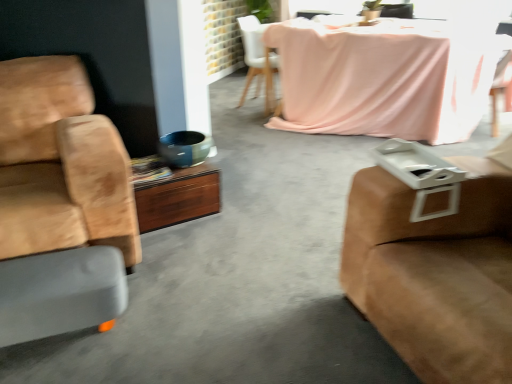
Identify the location of pink fabric chair at upper center, which is the second chair in right-to-left order. tap(258, 61).

The width and height of the screenshot is (512, 384). In order to click on wooden chair at upper right, the 1th chair when ordered from right to left in this screenshot , I will do `click(499, 88)`.

The height and width of the screenshot is (384, 512). What are the coordinates of `pink fabric-covered table at upper center` in the screenshot? It's located at (383, 79).

Identify the location of gray rubber footrest at lower left. (60, 293).

Is gray rubber footrest at lower left directly adjacent to pink fabric-covered table at upper center?

gray rubber footrest at lower left is not next to pink fabric-covered table at upper center, and they're not touching.

Which is correct: gray rubber footrest at lower left is inside pink fabric-covered table at upper center, or outside of it?

gray rubber footrest at lower left is not enclosed by pink fabric-covered table at upper center.

The height and width of the screenshot is (384, 512). Identify the location of the footrest below the pink fabric-covered table at upper center (from a real-world perspective). (60, 293).

In terms of width, does suede tan chair at left, the first chair viewed from the front, look wider or thinner when compared to wooden desk at center?

In the image, suede tan chair at left, the first chair viewed from the front, appears to be wider than wooden desk at center.

Does suede tan chair at left, arranged as the first chair when viewed from the left, have a lesser height compared to wooden desk at center?

No.

Does suede tan chair at left, placed as the third chair when sorted from right to left, come in front of wooden desk at center?

Yes.

From the picture: From a real-world perspective, is suede tan chair at left, the first chair viewed from the front, above or below wooden desk at center?

suede tan chair at left, the first chair viewed from the front, is above wooden desk at center.

Is gray rubber footrest at lower left looking in the opposite direction of pink fabric chair at upper center, the first chair when ordered from back to front?

No, pink fabric chair at upper center, the first chair when ordered from back to front, is not at the back of gray rubber footrest at lower left.

From a real-world perspective, is gray rubber footrest at lower left positioned above or below pink fabric chair at upper center, which is the second chair in right-to-left order?

From a real-world perspective, gray rubber footrest at lower left is physically below pink fabric chair at upper center, which is the second chair in right-to-left order.

Is point (10, 278) positioned before point (245, 92)?

That is True.

From the picture: Between gray rubber footrest at lower left and pink fabric chair at upper center, the first chair when ordered from back to front, which one has less height?

With less height is gray rubber footrest at lower left.

From the picture: Would you say wooden chair at upper right, the second chair when ordered from back to front, contains gray rubber footrest at lower left?

No.

How many degrees apart are the facing directions of wooden chair at upper right, which ranks as the second chair in front-to-back order, and gray rubber footrest at lower left?

45.9 degrees.

Is wooden chair at upper right, which is counted as the 3th chair, starting from the left, touching gray rubber footrest at lower left?

wooden chair at upper right, which is counted as the 3th chair, starting from the left, and gray rubber footrest at lower left are clearly separated.

Is gray rubber footrest at lower left shorter than wooden chair at upper right, the second chair when ordered from back to front?

Yes, gray rubber footrest at lower left is shorter than wooden chair at upper right, the second chair when ordered from back to front.

From a real-world perspective, who is located lower, gray rubber footrest at lower left or wooden chair at upper right, the second chair when ordered from back to front?

gray rubber footrest at lower left is physically lower.

Consider the image. Is gray rubber footrest at lower left inside the boundaries of wooden chair at upper right, the second chair when ordered from back to front, or outside?

gray rubber footrest at lower left exists outside the volume of wooden chair at upper right, the second chair when ordered from back to front.

Which of these two, gray rubber footrest at lower left or wooden chair at upper right, which is counted as the 3th chair, starting from the left, is smaller?

gray rubber footrest at lower left is smaller.

Based on the photo, considering the sizes of objects suede brown studio couch at right and pink fabric-covered table at upper center in the image provided, who is shorter, suede brown studio couch at right or pink fabric-covered table at upper center?

With less height is pink fabric-covered table at upper center.

Considering the relative positions of suede brown studio couch at right and pink fabric-covered table at upper center in the image provided, is suede brown studio couch at right to the left of pink fabric-covered table at upper center from the viewer's perspective?

Yes, suede brown studio couch at right is to the left of pink fabric-covered table at upper center.

Would you say pink fabric-covered table at upper center is part of suede brown studio couch at right's contents?

No, pink fabric-covered table at upper center is not a part of suede brown studio couch at right.

Can you confirm if suede brown studio couch at right is bigger than pink fabric-covered table at upper center?

Incorrect, suede brown studio couch at right is not larger than pink fabric-covered table at upper center.

From the picture: What's the angular difference between suede tan chair at left, the first chair viewed from the front, and gray rubber footrest at lower left's facing directions?

0.682 degrees separate the facing orientations of suede tan chair at left, the first chair viewed from the front, and gray rubber footrest at lower left.

Considering the relative sizes of suede tan chair at left, the first chair viewed from the front, and gray rubber footrest at lower left in the image provided, is suede tan chair at left, the first chair viewed from the front, bigger than gray rubber footrest at lower left?

Yes, suede tan chair at left, the first chair viewed from the front, is bigger than gray rubber footrest at lower left.

Is suede tan chair at left, the first chair viewed from the front, beside gray rubber footrest at lower left?

No, suede tan chair at left, the first chair viewed from the front, is not touching gray rubber footrest at lower left.

From the image's perspective, would you say suede tan chair at left, the first chair viewed from the front, is shown under gray rubber footrest at lower left?

No.

Locate an element on the screen. The height and width of the screenshot is (384, 512). kitchen & dining room table above the gray rubber footrest at lower left (from the image's perspective) is located at coordinates (383, 79).

Identify the location of desk directly beneath the suede tan chair at left, arranged as the first chair when viewed from the left (from a real-world perspective). The image size is (512, 384). (178, 197).

Estimate the real-world distances between objects in this image. Which object is further from gray rubber footrest at lower left, matte green ceramic bowl at center or pink fabric chair at upper center, which is the second chair in right-to-left order?

pink fabric chair at upper center, which is the second chair in right-to-left order.

Based on their spatial positions, is gray rubber footrest at lower left or suede tan chair at left, the third chair when ordered from back to front, further from wooden chair at upper right, the second chair when ordered from back to front?

Based on the image, gray rubber footrest at lower left appears to be further to wooden chair at upper right, the second chair when ordered from back to front.

Which object lies nearer to the anchor point wooden chair at upper right, which is counted as the 3th chair, starting from the left, gray rubber footrest at lower left or suede brown studio couch at right?

Among the two, suede brown studio couch at right is located nearer to wooden chair at upper right, which is counted as the 3th chair, starting from the left.

Looking at the image, which one is located further to gray rubber footrest at lower left, matte green ceramic bowl at center or wooden chair at upper right, the 1th chair when ordered from right to left?

Among the two, wooden chair at upper right, the 1th chair when ordered from right to left, is located further to gray rubber footrest at lower left.

Looking at the image, which one is located further to gray rubber footrest at lower left, wooden desk at center or pink fabric chair at upper center, which is the second chair in right-to-left order?

The object further to gray rubber footrest at lower left is pink fabric chair at upper center, which is the second chair in right-to-left order.

Considering their positions, is matte green ceramic bowl at center positioned closer to suede brown studio couch at right than suede tan chair at left, arranged as the first chair when viewed from the left?

suede tan chair at left, arranged as the first chair when viewed from the left, is positioned closer to the anchor suede brown studio couch at right.

Considering their positions, is suede brown studio couch at right positioned further to wooden chair at upper right, which is counted as the 3th chair, starting from the left, than suede tan chair at left, arranged as the first chair when viewed from the left?

suede tan chair at left, arranged as the first chair when viewed from the left, is positioned further to the anchor wooden chair at upper right, which is counted as the 3th chair, starting from the left.

From the image, which object appears to be farther from wooden desk at center, suede brown studio couch at right or pink fabric-covered table at upper center?

Among the two, pink fabric-covered table at upper center is located further to wooden desk at center.

Identify the location of vase between suede tan chair at left, the first chair viewed from the front, and wooden chair at upper right, the 1th chair when ordered from right to left, in the horizontal direction. (184, 148).

Where is `vase between wooden desk at center and suede brown studio couch at right in the horizontal direction`? The height and width of the screenshot is (384, 512). vase between wooden desk at center and suede brown studio couch at right in the horizontal direction is located at coordinates (184, 148).

Find the location of a particular element. The height and width of the screenshot is (384, 512). footrest between suede tan chair at left, the third chair when ordered from back to front, and matte green ceramic bowl at center from front to back is located at coordinates (60, 293).

Where is `vase located between wooden desk at center and pink fabric-covered table at upper center in the left-right direction`? This screenshot has width=512, height=384. vase located between wooden desk at center and pink fabric-covered table at upper center in the left-right direction is located at coordinates (184, 148).